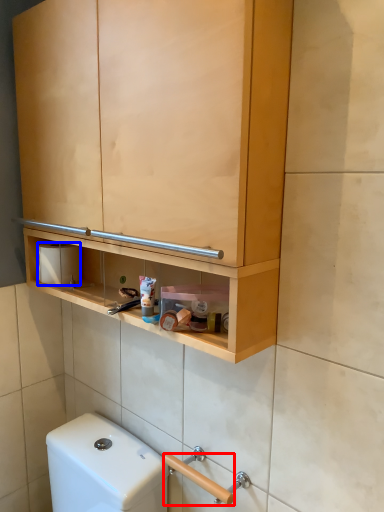
Question: Which of the following is the farthest to the observer, door handle (highlighted by a red box) or toilet paper (highlighted by a blue box)?

Choices:
 (A) door handle
 (B) toilet paper

Answer: (B)